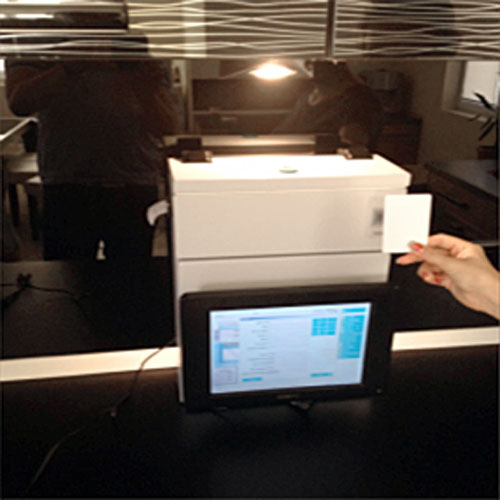
Identify the location of light. The height and width of the screenshot is (500, 500). (273, 70).